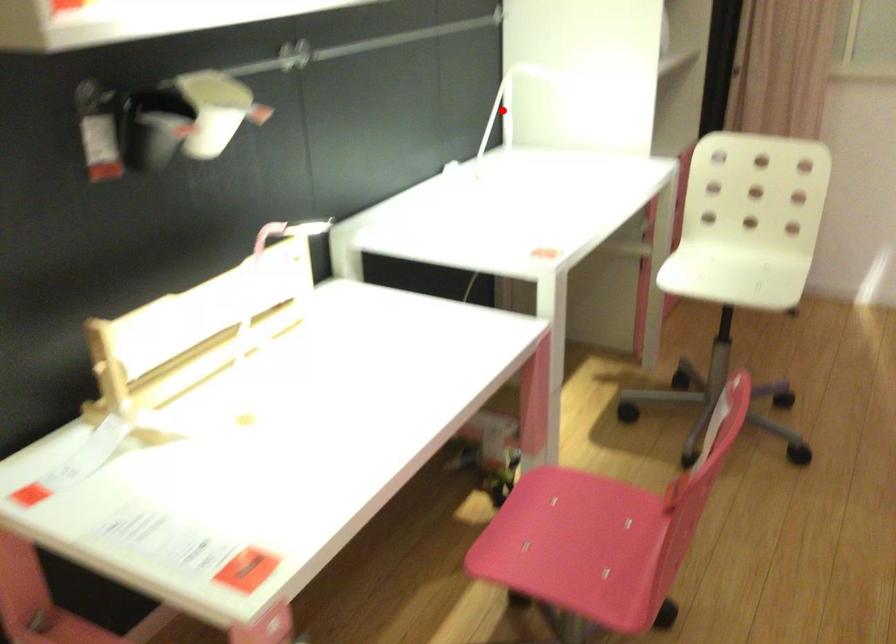
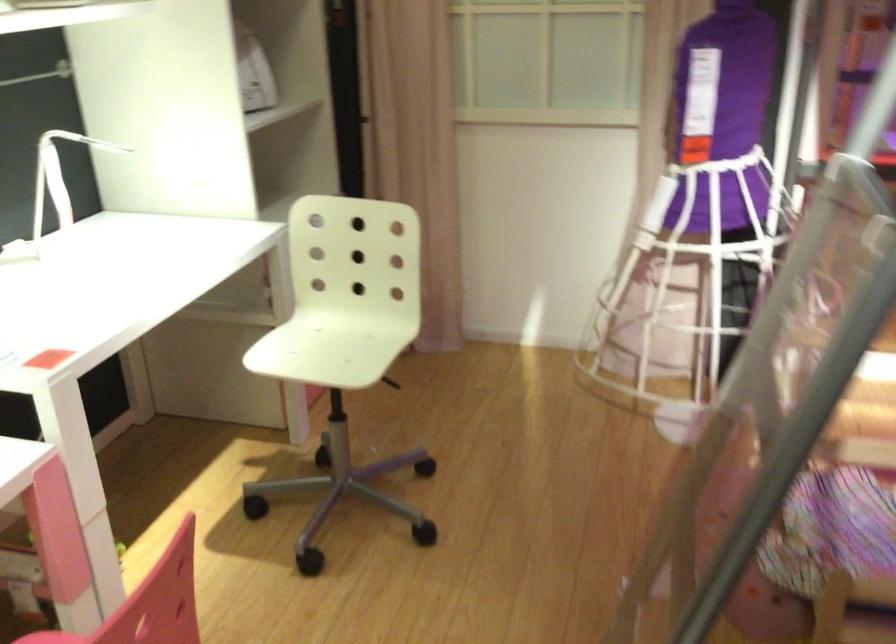
Question: I am providing you with two images of the same scene from different viewpoints. Image1 has a red point marked. In image2, the corresponding 3D location appears at what relative position? Reply with the corresponding letter.

Choices:
 (A) Closer
 (B) Farther

Answer: (A)